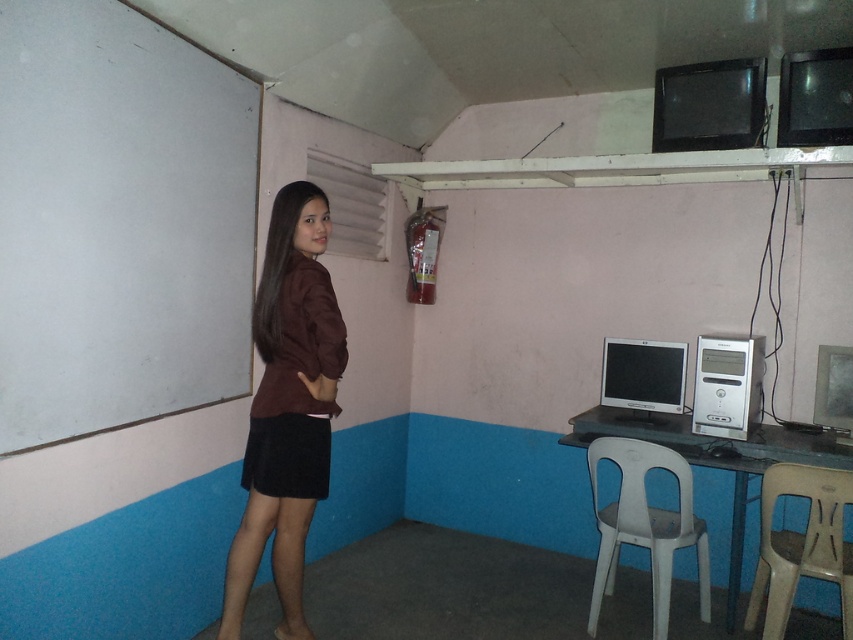
Question: Is beige plastic chair at lower right to the right of matte silver monitor at center from the viewer's perspective?

Choices:
 (A) yes
 (B) no

Answer: (A)

Question: Is white plastic table at lower right further to the viewer compared to matte black monitor at right?

Choices:
 (A) yes
 (B) no

Answer: (B)

Question: Which object appears farthest from the camera in this image?

Choices:
 (A) matte black monitor at right
 (B) white plastic table at lower right
 (C) silver metallic desktop at center-right
 (D) matte silver monitor at center

Answer: (D)

Question: Is white plastic chair at lower right smaller than matte silver monitor at center?

Choices:
 (A) no
 (B) yes

Answer: (A)

Question: Which of the following is the closest to the observer?

Choices:
 (A) matte black monitor at right
 (B) beige plastic chair at lower right
 (C) silver metallic desktop at center-right
 (D) white plastic chair at lower right

Answer: (B)

Question: Which object is the closest to the white plastic table at lower right?

Choices:
 (A) matte silver monitor at center
 (B) brown matte skirt at lower left

Answer: (A)